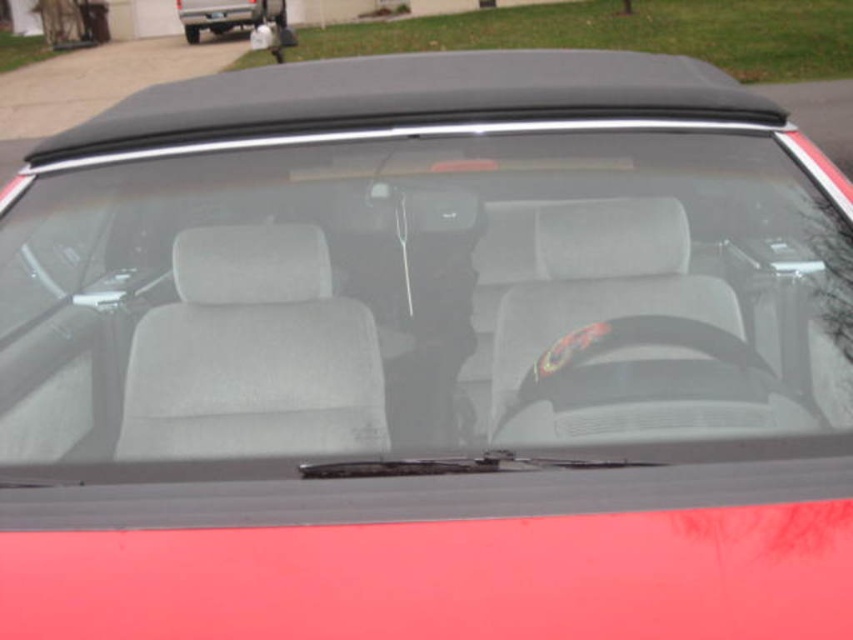
Question: Among these points, which one is farthest from the camera?

Choices:
 (A) (242, 260)
 (B) (196, 17)

Answer: (B)

Question: Estimate the real-world distances between objects in this image. Which object is closer to the matte black convertible at upper center?

Choices:
 (A) gray fabric seat at center
 (B) black plastic license plate at center

Answer: (B)

Question: Is gray fabric seat at center smaller than black plastic license plate at center?

Choices:
 (A) yes
 (B) no

Answer: (B)

Question: Which point is farther from the camera taking this photo?

Choices:
 (A) (218, 13)
 (B) (195, 1)
 (C) (219, 356)

Answer: (A)

Question: Observing the image, what is the correct spatial positioning of matte black convertible at upper center in reference to black plastic license plate at center?

Choices:
 (A) below
 (B) above

Answer: (A)

Question: Is gray fabric seat at center thinner than matte black convertible at upper center?

Choices:
 (A) yes
 (B) no

Answer: (A)